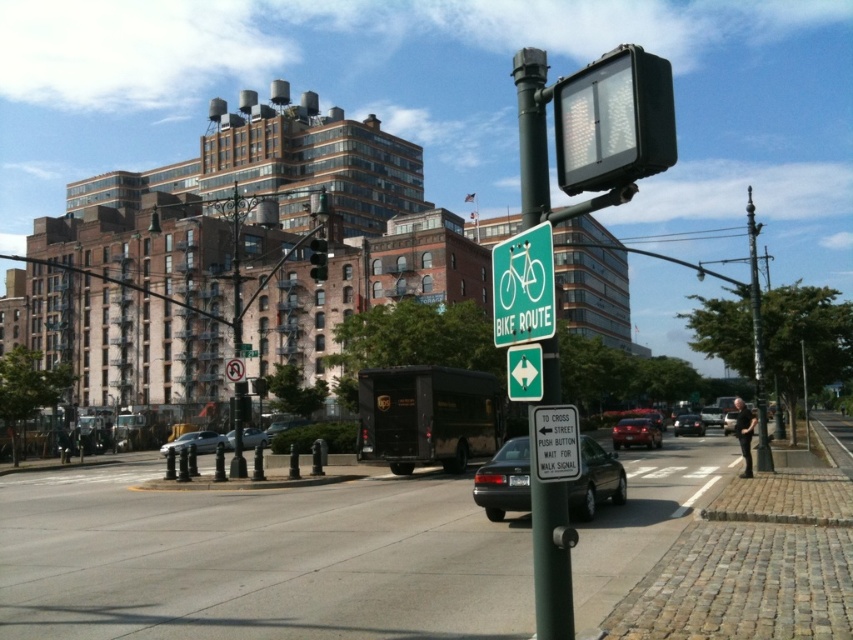
Question: Does silver metallic pole at right have a larger size compared to white plastic no left turn sign at center?

Choices:
 (A) no
 (B) yes

Answer: (B)

Question: Can you confirm if green metallic sign at center is positioned to the left of silver metallic sedan at center?

Choices:
 (A) yes
 (B) no

Answer: (B)

Question: Which point is closer to the camera taking this photo?

Choices:
 (A) (654, 428)
 (B) (323, 273)
 (C) (612, 67)
 (D) (366, 580)

Answer: (C)

Question: Estimate the real-world distances between objects in this image. Which object is closer to the silver metallic sedan at center?

Choices:
 (A) green plastic traffic sign at center
 (B) cobblestone pavement at lower right

Answer: (B)

Question: In this image, where is cobblestone pavement at lower right located relative to black glass traffic light at upper center?

Choices:
 (A) above
 (B) below

Answer: (B)

Question: Which object is closer to the camera taking this photo?

Choices:
 (A) green matte bike route sign at center
 (B) black glossy sedan at center
 (C) silver metallic pole at right

Answer: (A)